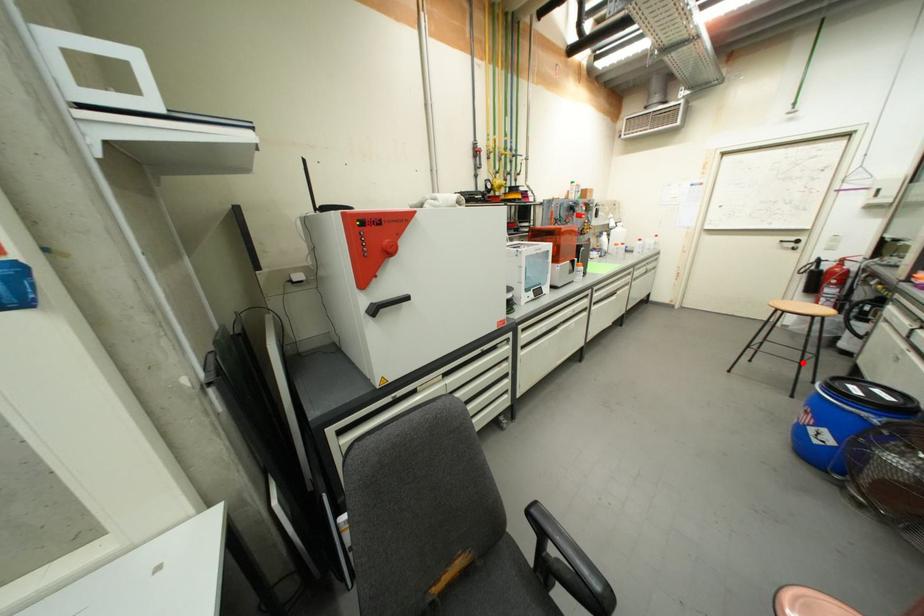
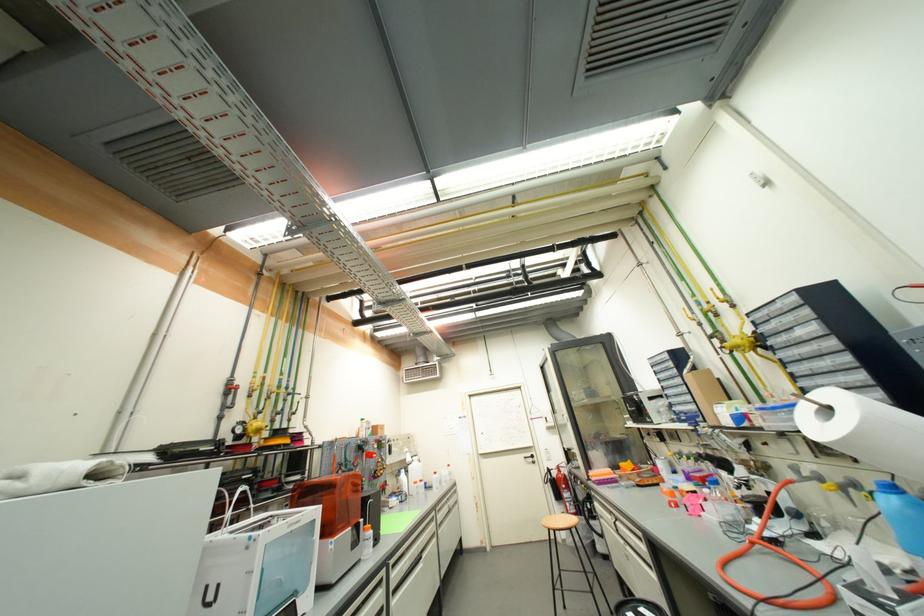
Question: I am providing you with two images of the same scene from different viewpoints. Image1 has a red point marked. In image2, the corresponding 3D location appears at what relative position? Reply with the corresponding letter.

Choices:
 (A) Closer
 (B) Farther

Answer: (A)